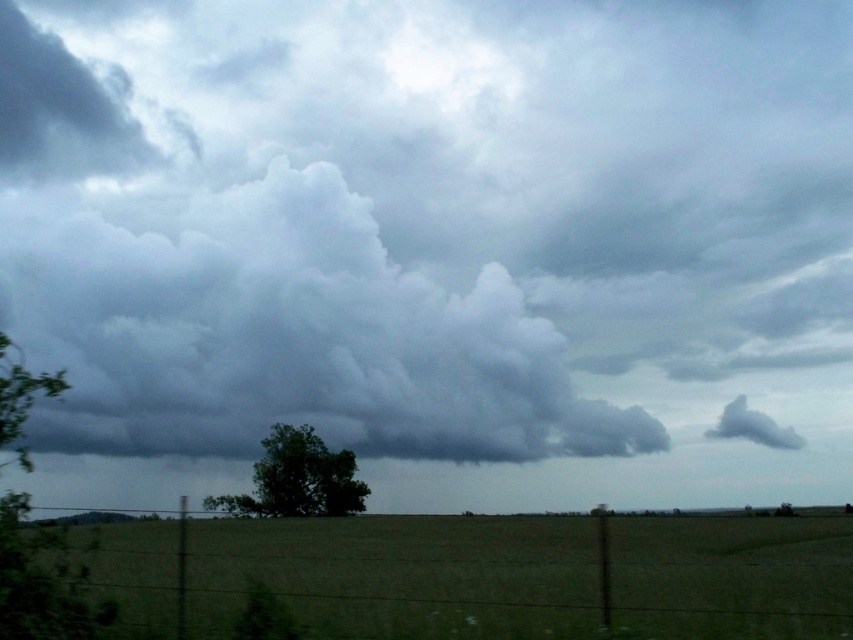
You are standing in the field looking towards the horizon. You see a green leafy tree at left and a gray fluffy cloud at upper right. Which object is positioned to the left of the other?

The green leafy tree at left is positioned to the left of the gray fluffy cloud at upper right.

You are standing at the center of the grassy field bordered by a wire fence. You see the green leafy tree at left in the distance. Based on its position coordinates, can you tell me which direction the tree is located relative to your current position?

The green leafy tree at left is located at coordinates point (42, 582), which places it to the left side of the scene. Therefore, the tree is positioned to the left relative to your current position in the center of the field.

You are standing in the rural landscape scene. There are two points marked in the image. The first point is at coordinate point(3,552) and the second point is at coordinate point(277,454). Which point is closer to you?

Point(3,552) is closer to the viewer than point(277,454).